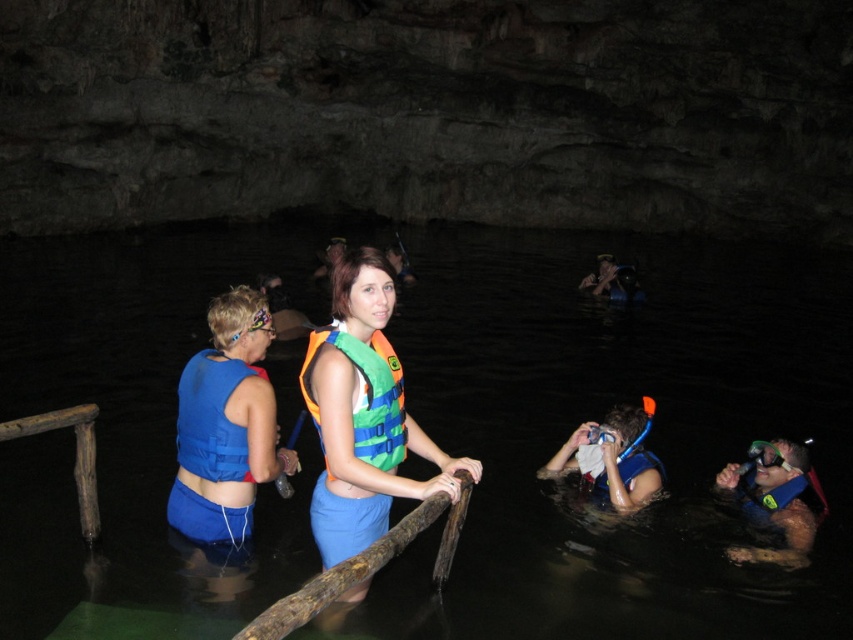
Between blue life vest at left and blue life vest at lower center, which one has more height?

Standing taller between the two is blue life vest at left.

Can you confirm if blue life vest at left is thinner than blue life vest at lower center?

Indeed, blue life vest at left has a lesser width compared to blue life vest at lower center.

Describe the element at coordinates (225, 424) in the screenshot. This screenshot has height=640, width=853. I see `blue life vest at left` at that location.

You are a GUI agent. You are given a task and a screenshot of the screen. Output one action in this format:
    pyautogui.click(x=<x>, y=<y>)
    Task: Click on the blue life vest at left
    
    Given the screenshot: What is the action you would take?
    pyautogui.click(x=225, y=424)

Based on the photo, is blue fabric life vest at center positioned in front of blue life vest at left?

Yes, blue fabric life vest at center is in front of blue life vest at left.

Between blue fabric life vest at center and blue life vest at left, which one has more height?

Standing taller between the two is blue fabric life vest at center.

Locate an element on the screen. The height and width of the screenshot is (640, 853). blue fabric life vest at center is located at coordinates (601, 419).

Is blue fabric life vest at center further to camera compared to blue life vest at lower center?

No, it is not.

Describe the element at coordinates (601, 419) in the screenshot. The height and width of the screenshot is (640, 853). I see `blue fabric life vest at center` at that location.

The width and height of the screenshot is (853, 640). I want to click on blue fabric life vest at center, so click(601, 419).